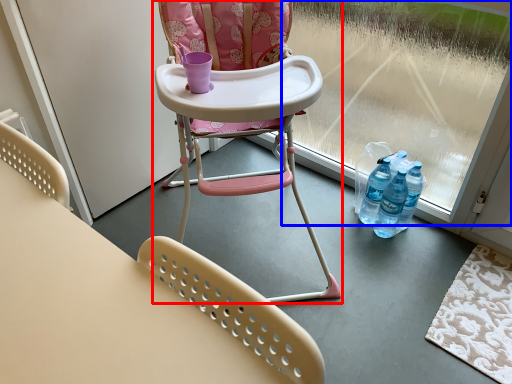
Question: Which object appears closest to the camera in this image, chair (highlighted by a red box) or window screen (highlighted by a blue box)?

Choices:
 (A) chair
 (B) window screen

Answer: (A)